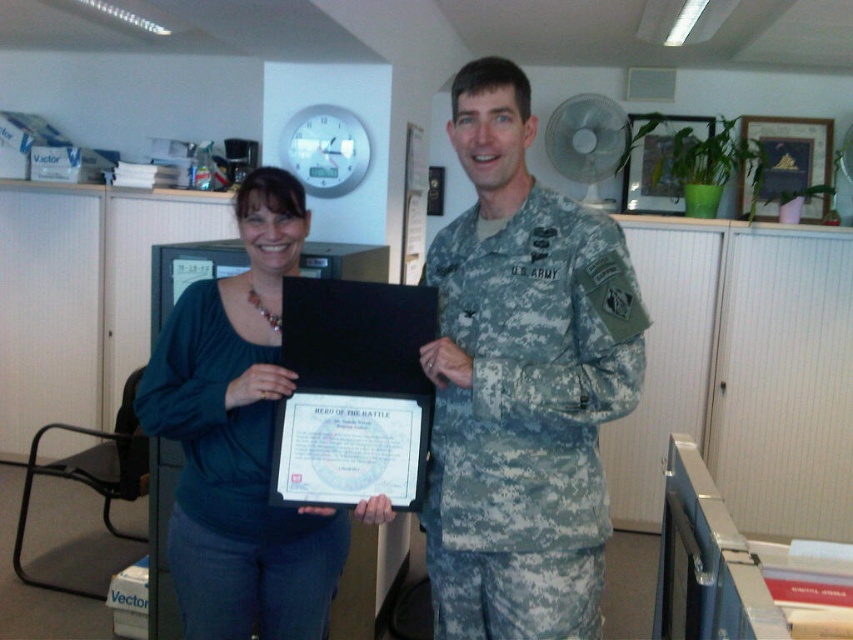
Question: Can you confirm if camouflage uniform at center is positioned to the left of teal fabric shirt at center?

Choices:
 (A) no
 (B) yes

Answer: (A)

Question: Can you confirm if camouflage uniform at center is smaller than teal fabric shirt at center?

Choices:
 (A) no
 (B) yes

Answer: (B)

Question: Does camouflage uniform at center have a lesser width compared to teal fabric shirt at center?

Choices:
 (A) yes
 (B) no

Answer: (A)

Question: Among these objects, which one is nearest to the camera?

Choices:
 (A) camouflage uniform at center
 (B) teal fabric shirt at center

Answer: (A)